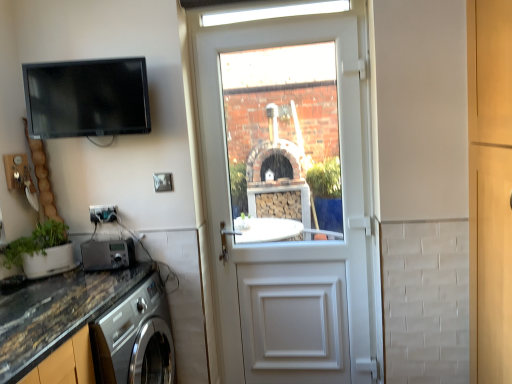
Identify the location of vacant area on top of metallic silver radio at lower left, marked as the second appliance in a top-to-bottom arrangement (from a real-world perspective). tap(111, 237).